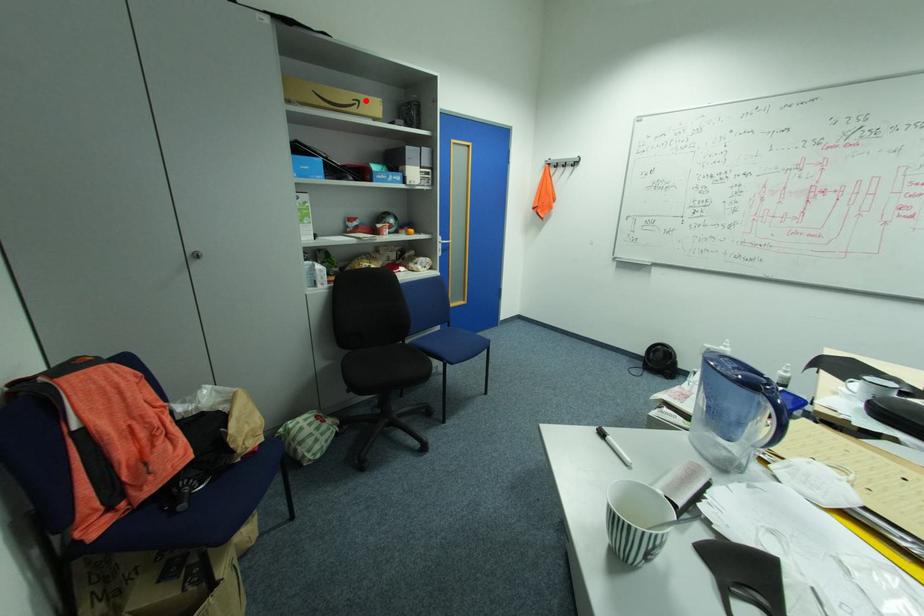
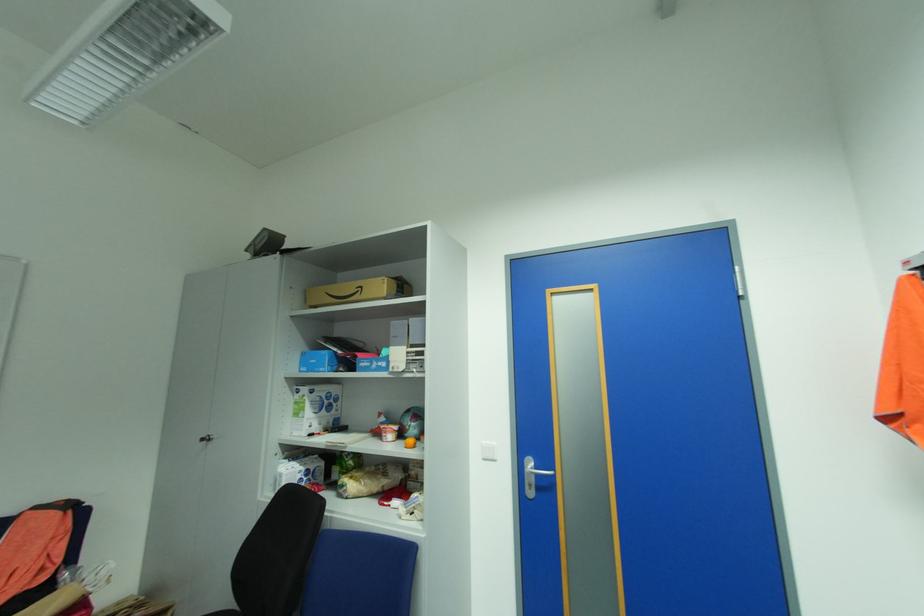
Where in the second image is the point corresponding to the highlighted location from the first image?

(368, 286)